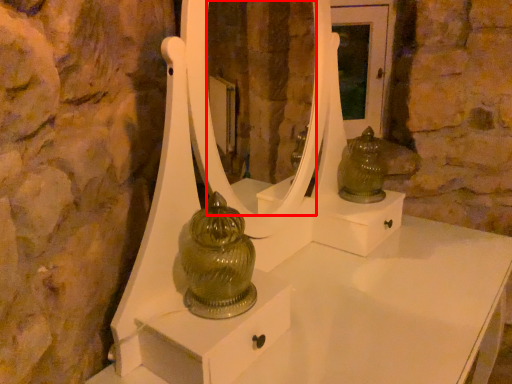
Question: From the image's perspective, what is the correct spatial relationship of mirror (annotated by the red box) in relation to figurine?

Choices:
 (A) above
 (B) below

Answer: (A)